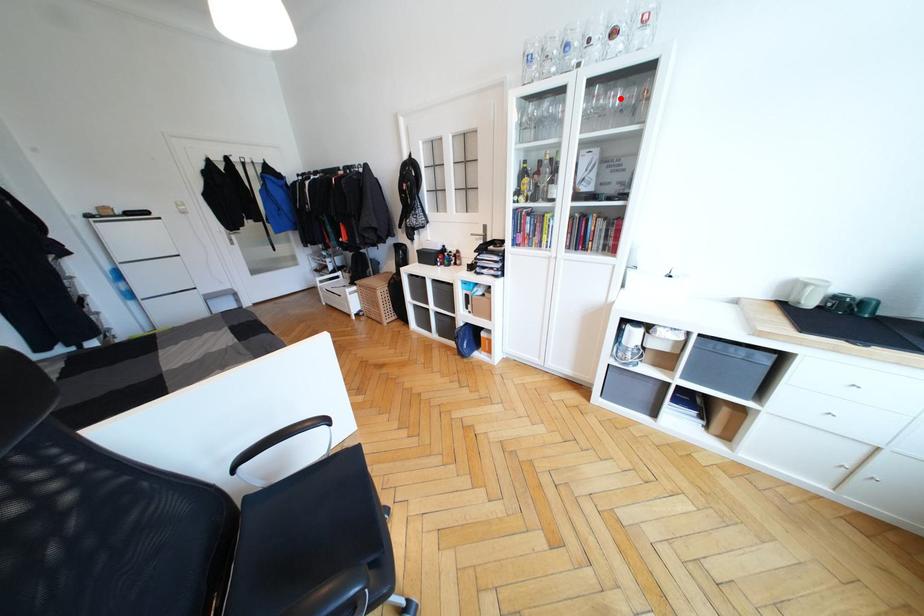
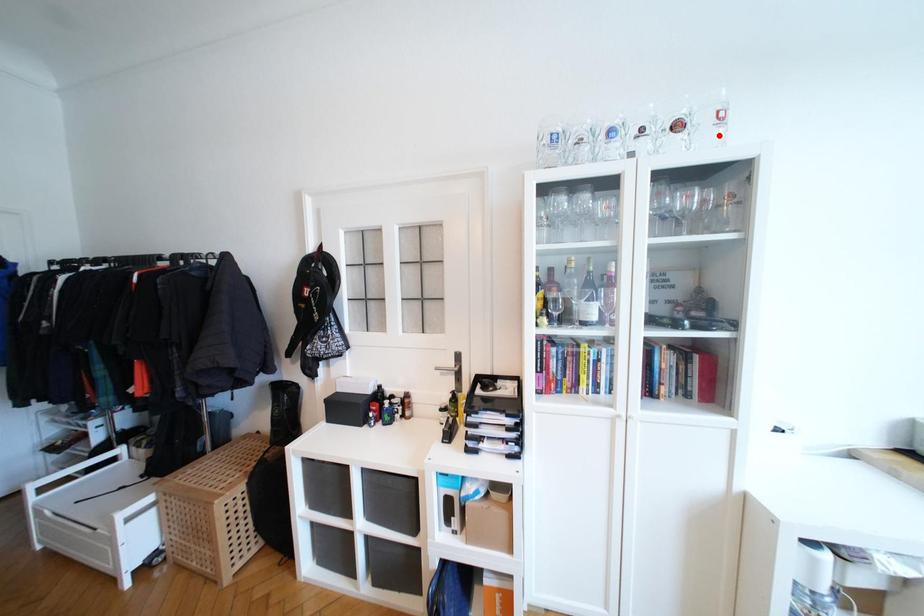
I am providing you with two images of the same scene from different viewpoints. A red point is marked on the first image and another point is marked on the second image. Are the points marked in image1 and image2 representing the same 3D position?

No